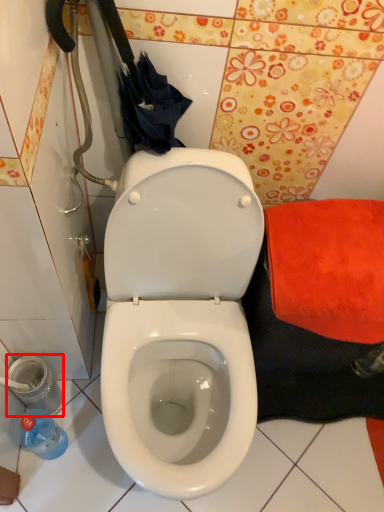
Question: Where is potty (annotated by the red box) located in relation to bottle in the image?

Choices:
 (A) left
 (B) right

Answer: (A)